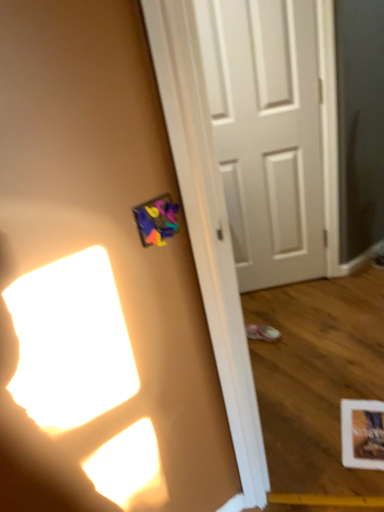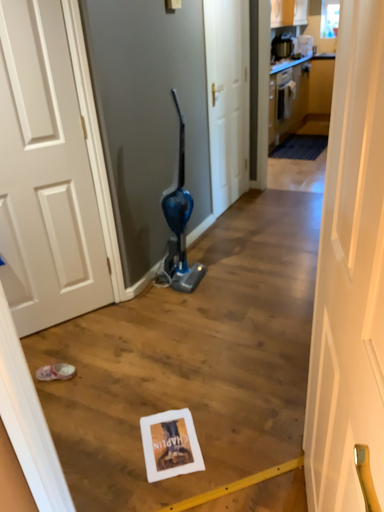
Question: Which way did the camera rotate in the video?

Choices:
 (A) rotated left
 (B) rotated right

Answer: (B)